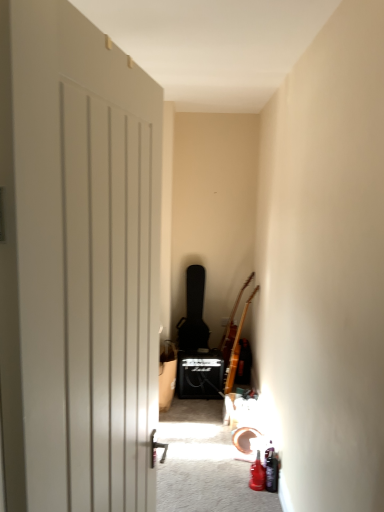
Question: Based on their positions, is wooden acoustic guitar at right, positioned as the first guitar in right-to-left order, located to the left or right of black matte guitar case at center, the third guitar in the right-to-left sequence?

Choices:
 (A) right
 (B) left

Answer: (A)

Question: Considering the positions of wooden acoustic guitar at right, positioned as the first guitar in right-to-left order, and black matte guitar case at center, arranged as the first guitar when viewed from the left, in the image, is wooden acoustic guitar at right, positioned as the first guitar in right-to-left order, wider or thinner than black matte guitar case at center, arranged as the first guitar when viewed from the left,?

Choices:
 (A) wide
 (B) thin

Answer: (B)

Question: Which of these objects is positioned farthest from the black matte guitar case at center, the third guitar in the right-to-left sequence?

Choices:
 (A) brown wooden guitar at upper right, which is counted as the 2th guitar, starting from the left
 (B) wooden acoustic guitar at right, positioned as the first guitar in right-to-left order

Answer: (B)

Question: Considering the real-world distances, which object is farthest from the brown wooden guitar at upper right, which is counted as the 2th guitar, starting from the left?

Choices:
 (A) wooden acoustic guitar at right, positioned as the first guitar in right-to-left order
 (B) black matte guitar case at center, arranged as the first guitar when viewed from the left

Answer: (B)